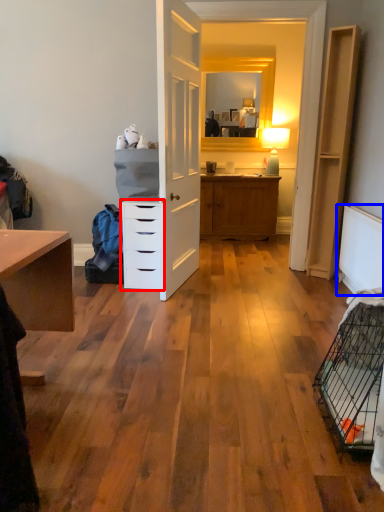
Question: Among these objects, which one is farthest to the camera, chest of drawers (highlighted by a red box) or radiator (highlighted by a blue box)?

Choices:
 (A) chest of drawers
 (B) radiator

Answer: (A)